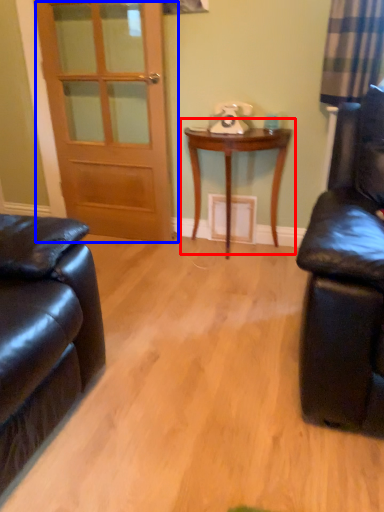
Question: Which object is closer to the camera taking this photo, table (highlighted by a red box) or door (highlighted by a blue box)?

Choices:
 (A) table
 (B) door

Answer: (A)